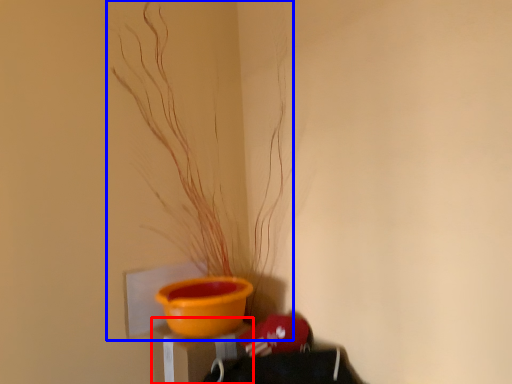
Question: Which of the following is the closest to the observer, table (highlighted by a red box) or houseplant (highlighted by a blue box)?

Choices:
 (A) table
 (B) houseplant

Answer: (B)